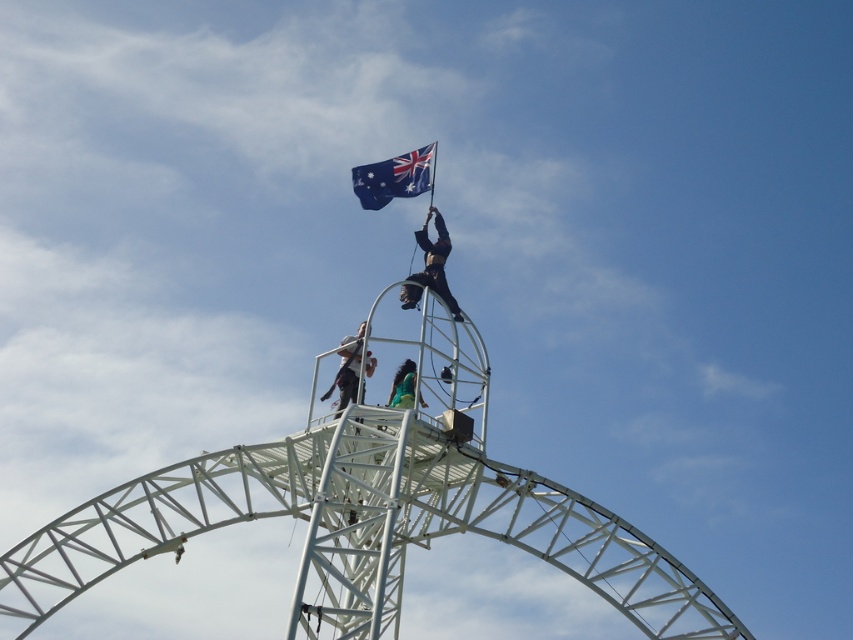
Question: Is black fabric person at upper center to the right of dark gray fabric at center from the viewer's perspective?

Choices:
 (A) yes
 (B) no

Answer: (A)

Question: Which object is positioned farthest from the blue fabric flag at top?

Choices:
 (A) dark gray fabric at center
 (B) black fabric person at upper center
 (C) green fabric at center

Answer: (C)

Question: Can you confirm if black fabric person at upper center is bigger than green fabric at center?

Choices:
 (A) yes
 (B) no

Answer: (A)

Question: Which point is farther from the camera taking this photo?

Choices:
 (A) (402, 378)
 (B) (372, 208)
 (C) (364, 355)

Answer: (B)

Question: Can you confirm if black fabric person at upper center is bigger than green fabric at center?

Choices:
 (A) no
 (B) yes

Answer: (B)

Question: Estimate the real-world distances between objects in this image. Which object is closer to the blue fabric flag at top?

Choices:
 (A) green fabric at center
 (B) dark gray fabric at center
 (C) black fabric person at upper center

Answer: (C)